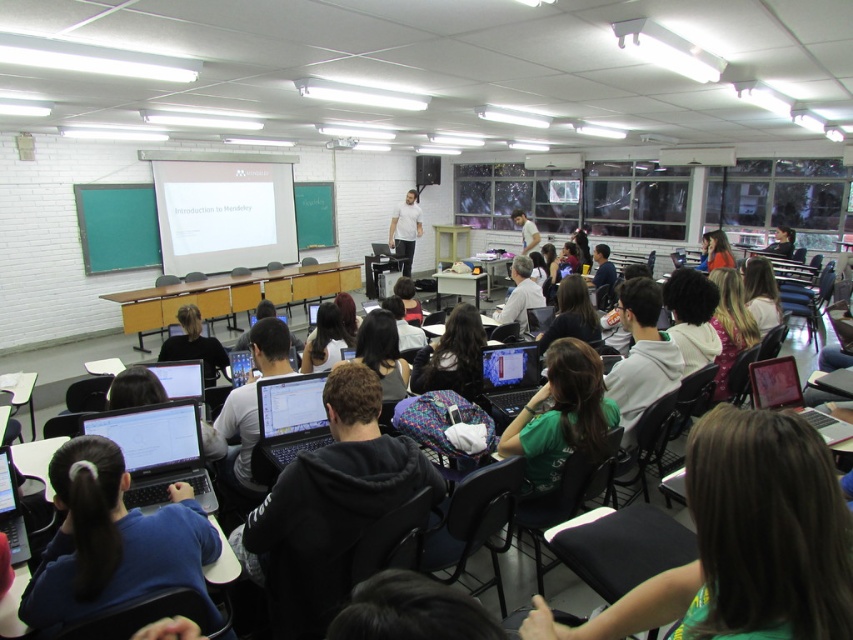
Is point (178, 369) in front of point (248, 369)?

Yes, point (178, 369) is closer to viewer.

Who is more distant from viewer, [167,380] or [253,365]?

Positioned behind is point [253,365].

I want to click on matte black laptop at center, so click(x=181, y=380).

Find the location of a particular element. Image resolution: width=853 pixels, height=640 pixels. matte black laptop at center is located at coordinates (181, 380).

Who is higher up, satin black laptop at lower left or satin black laptop at center?

Positioned higher is satin black laptop at center.

Is point (195, 410) closer to camera compared to point (254, 456)?

Yes, point (195, 410) is closer to viewer.

Which is in front, point (157, 429) or point (303, 435)?

Positioned in front is point (157, 429).

Identify the location of satin black laptop at lower left. (157, 451).

Is green matte shirt at center further to camera compared to matte black laptop at center?

No, green matte shirt at center is closer to the viewer.

Measure the distance between green matte shirt at center and camera.

green matte shirt at center is 8.34 feet away from camera.

Image resolution: width=853 pixels, height=640 pixels. In order to click on green matte shirt at center in this screenshot , I will do `click(560, 416)`.